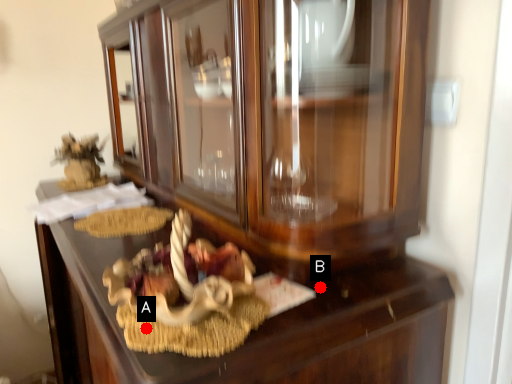
Question: Two points are circled on the image, labeled by A and B beside each circle. Which point is farther from the camera taking this photo?

Choices:
 (A) A is further
 (B) B is further

Answer: (B)